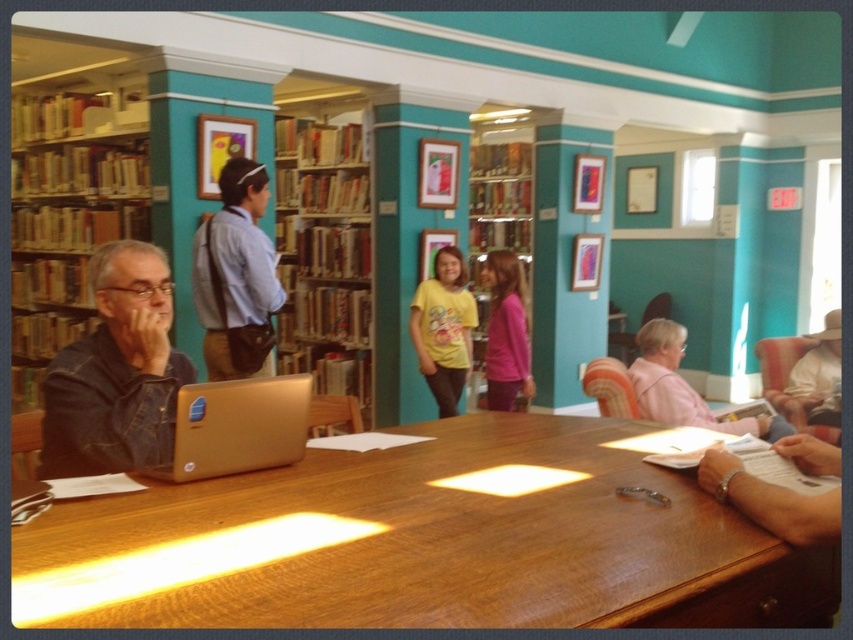
Based on the photo, you are standing in the library and want to reach a book on the top shelf of the wooden bookcase at center. You are wearing the light blue shirt at center. Can you reach the book without any assistance?

The wooden bookcase at center is much taller than the light blue shirt at center, so you cannot reach the book on the top shelf without assistance.

Please describe the location of the wooden table at center in terms of its coordinates within the image. The coordinates are given as a point with x and y values between 0 and 1, where 0,0 is the bottom left corner and 1,1 is the top right corner. The coordinates provided are point (424, 541). Please answer using the coordinates given without adding any extra information.

The wooden table at center is located at coordinates point (424, 541).